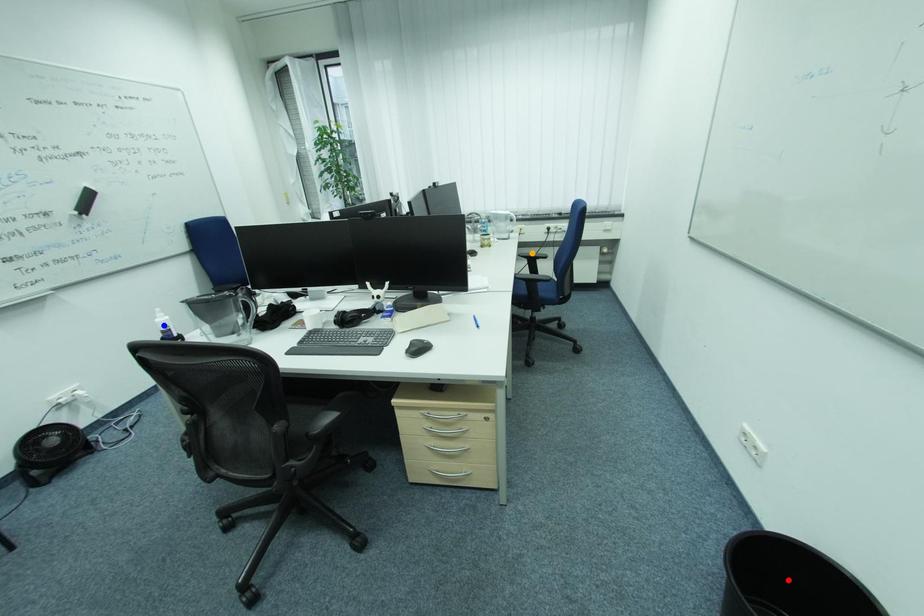
Order these from nearest to farthest:
1. orange point
2. blue point
3. red point

red point < blue point < orange point